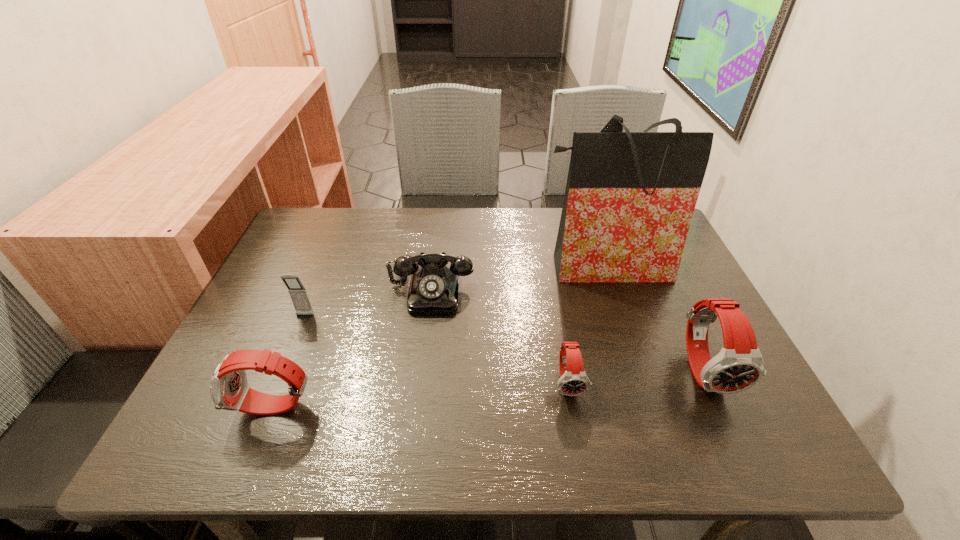
To ensure equal spacing by inserting another watch among them, please point out a vacant spot for this new watch. Please provide its 2D coordinates. Your answer should be formatted as a tuple, i.e. [(x, y)], where the tuple contains the x and y coordinates of a point satisfying the conditions above.

[(425, 395)]